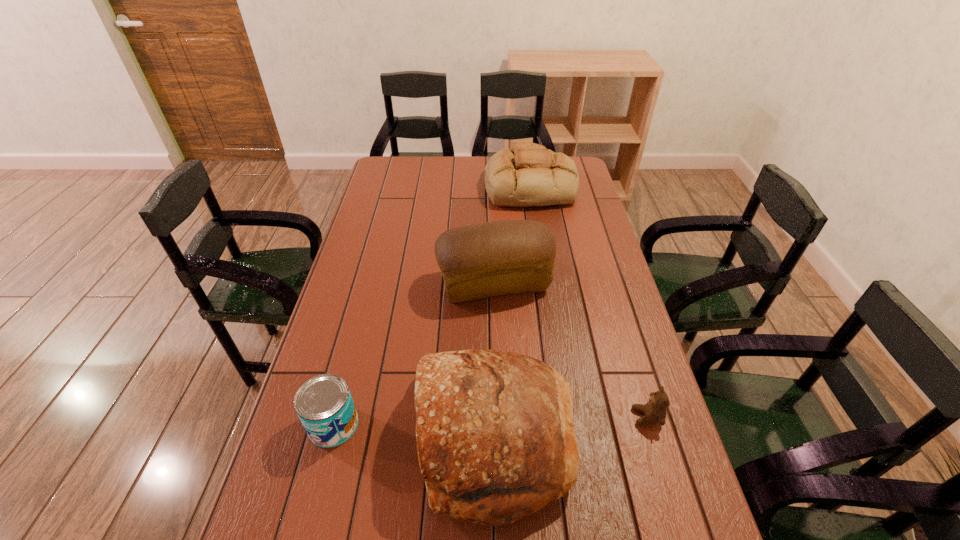
The image size is (960, 540). I want to click on free space located at the sliced front of the nearest bread, so click(x=321, y=437).

Locate an element on the screen. The width and height of the screenshot is (960, 540). free location located on the front of the farthest bread is located at coordinates (540, 245).

Identify the location of vacant space located 0.300m on the right of the can. The image size is (960, 540). (480, 424).

Locate an element on the screen. vacant area located 0.170m at the face of the teddy bear is located at coordinates (564, 417).

Identify the location of free space located at the face of the teddy bear. Image resolution: width=960 pixels, height=540 pixels. (529, 417).

Locate an element on the screen. free space located 0.270m at the face of the teddy bear is located at coordinates (525, 417).

The image size is (960, 540). What are the coordinates of `object located in the far edge section of the desktop` in the screenshot? It's located at (528, 175).

Identify the location of object that is at the left edge. The height and width of the screenshot is (540, 960). 324,405.

Image resolution: width=960 pixels, height=540 pixels. Find the location of `bread that is at the right edge`. bread that is at the right edge is located at coordinates (528, 175).

The height and width of the screenshot is (540, 960). What are the coordinates of `teddy bear present at the right edge` in the screenshot? It's located at (654, 411).